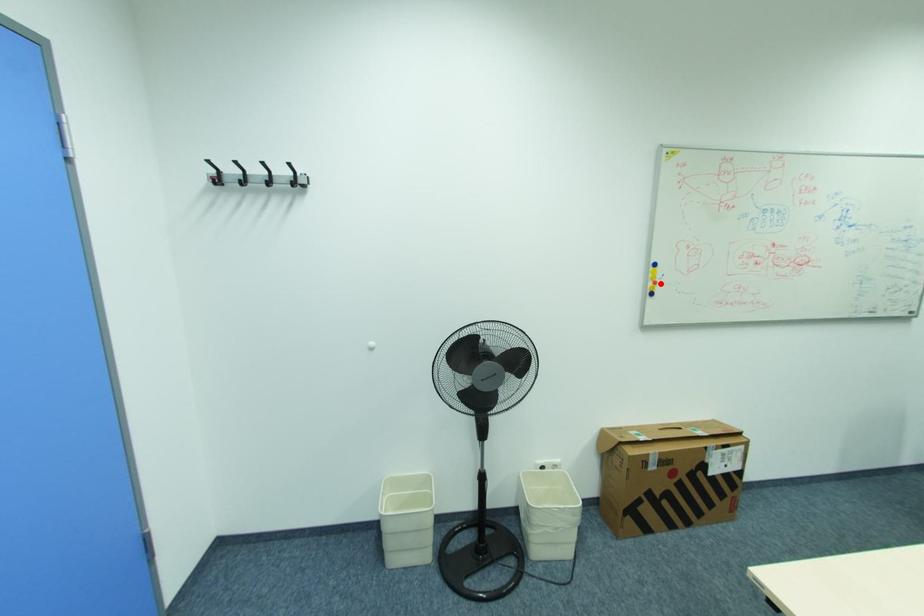
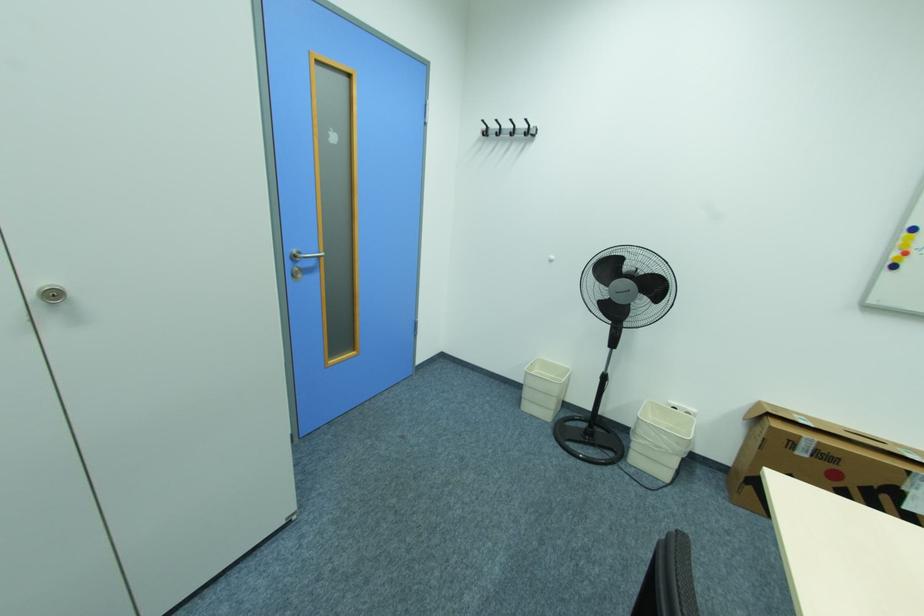
Question: I am providing you with two images of the same scene from different viewpoints. A red point is shown in image1. For the corresponding object point in image2, is it positioned nearer or farther from the camera?

Choices:
 (A) Nearer
 (B) Farther

Answer: (B)